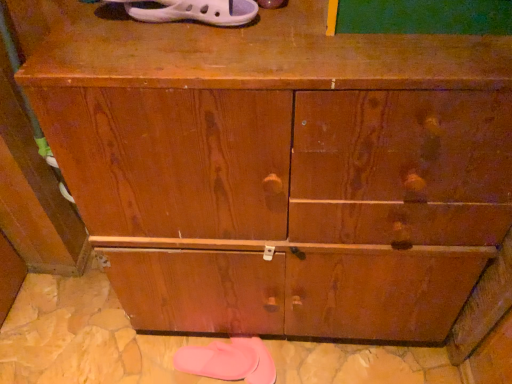
Question: In which direction should I rotate to look at white rubber sandal at upper center, the 2th footwear in the bottom-to-top sequence?

Choices:
 (A) right
 (B) left

Answer: (B)

Question: In which direction should I rotate to look at pink rubber slipper at lower center, the first footwear from the bottom?

Choices:
 (A) left
 (B) right

Answer: (A)

Question: Is the depth of white rubber sandal at upper center, positioned as the first footwear in front-to-back order, greater than that of pink rubber slipper at lower center, acting as the 2th footwear starting from the front?

Choices:
 (A) no
 (B) yes

Answer: (A)

Question: From the image's perspective, is white rubber sandal at upper center, the 2th footwear in the bottom-to-top sequence, beneath pink rubber slipper at lower center, which is counted as the second footwear, starting from the top?

Choices:
 (A) yes
 (B) no

Answer: (B)

Question: Considering the relative sizes of white rubber sandal at upper center, the 2th footwear in the bottom-to-top sequence, and pink rubber slipper at lower center, the first footwear from the bottom, in the image provided, is white rubber sandal at upper center, the 2th footwear in the bottom-to-top sequence, bigger than pink rubber slipper at lower center, the first footwear from the bottom,?

Choices:
 (A) yes
 (B) no

Answer: (A)

Question: Does white rubber sandal at upper center, the 2th footwear in the bottom-to-top sequence, appear on the right side of pink rubber slipper at lower center, acting as the 2th footwear starting from the front?

Choices:
 (A) no
 (B) yes

Answer: (B)

Question: Can you confirm if white rubber sandal at upper center, arranged as the 1th footwear when viewed from the top, is wider than pink rubber slipper at lower center, acting as the 2th footwear starting from the front?

Choices:
 (A) no
 (B) yes

Answer: (B)

Question: Can pink rubber slipper at lower center, which is counted as the second footwear, starting from the top, be found inside white rubber sandal at upper center, positioned as the first footwear in front-to-back order?

Choices:
 (A) no
 (B) yes

Answer: (A)

Question: Does pink rubber slipper at lower center, positioned as the 1th footwear in back-to-front order, appear on the left side of white rubber sandal at upper center, arranged as the 1th footwear when viewed from the top?

Choices:
 (A) yes
 (B) no

Answer: (A)

Question: Is pink rubber slipper at lower center, which is counted as the second footwear, starting from the top, shorter than white rubber sandal at upper center, the 2th footwear in the bottom-to-top sequence?

Choices:
 (A) yes
 (B) no

Answer: (B)

Question: Can you confirm if pink rubber slipper at lower center, positioned as the 1th footwear in back-to-front order, is wider than white rubber sandal at upper center, positioned as the first footwear in front-to-back order?

Choices:
 (A) yes
 (B) no

Answer: (B)

Question: From a real-world perspective, does pink rubber slipper at lower center, acting as the 2th footwear starting from the front, sit lower than white rubber sandal at upper center, the 2th footwear in the bottom-to-top sequence?

Choices:
 (A) yes
 (B) no

Answer: (A)

Question: Does pink rubber slipper at lower center, which is counted as the second footwear, starting from the top, appear on the right side of white rubber sandal at upper center, the 2th footwear in the bottom-to-top sequence?

Choices:
 (A) no
 (B) yes

Answer: (A)

Question: Are pink rubber slipper at lower center, which is counted as the second footwear, starting from the top, and white rubber sandal at upper center, the 2th footwear in the bottom-to-top sequence, making contact?

Choices:
 (A) no
 (B) yes

Answer: (A)

Question: Is white rubber sandal at upper center, positioned as the first footwear in front-to-back order, taller or shorter than pink rubber slipper at lower center, the first footwear from the bottom?

Choices:
 (A) short
 (B) tall

Answer: (A)